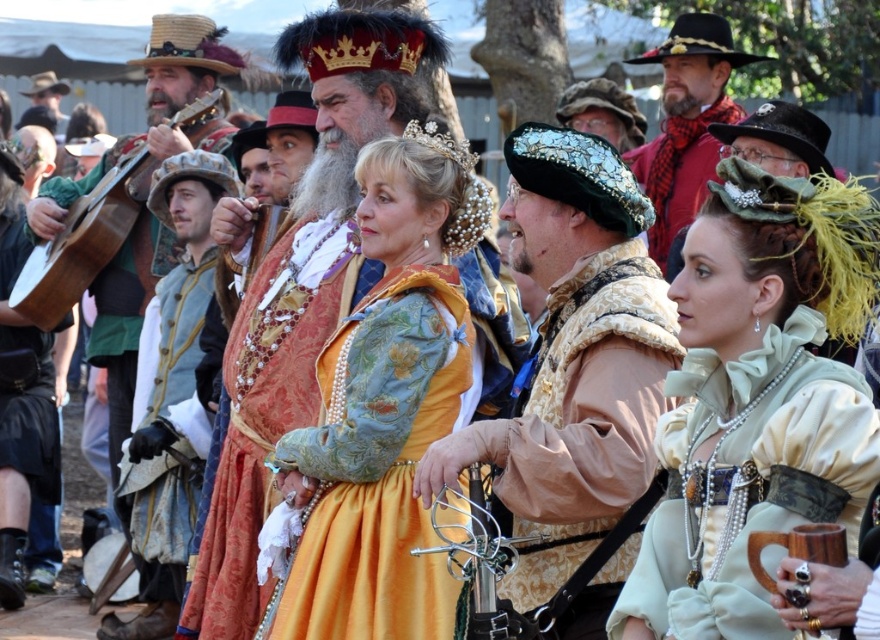
Does matte cream fabric dress at center appear on the right side of matte red scarf at center?

Incorrect, matte cream fabric dress at center is not on the right side of matte red scarf at center.

Is matte cream fabric dress at center bigger than matte red scarf at center?

Incorrect, matte cream fabric dress at center is not larger than matte red scarf at center.

Who is more distant from viewer, (x=730, y=467) or (x=698, y=198)?

Point (x=698, y=198)

Where is `matte cream fabric dress at center`? The image size is (880, 640). matte cream fabric dress at center is located at coordinates (756, 400).

Can you confirm if shiny silver helmet at center is wider than matte brown leather hat at upper left?

Indeed, shiny silver helmet at center has a greater width compared to matte brown leather hat at upper left.

Which is more to the right, shiny silver helmet at center or matte brown leather hat at upper left?

shiny silver helmet at center

In order to click on shiny silver helmet at center in this screenshot , I will do `click(602, 113)`.

Between matte gold dress at center and gold brocade dress at center, which one is positioned higher?

matte gold dress at center is higher up.

Based on the photo, can you confirm if matte gold dress at center is taller than gold brocade dress at center?

Correct, matte gold dress at center is much taller as gold brocade dress at center.

Consider the image. Who is more distant from viewer, [456,376] or [277,362]?

The point [277,362] is behind.

The width and height of the screenshot is (880, 640). In order to click on matte gold dress at center in this screenshot , I will do (380, 412).